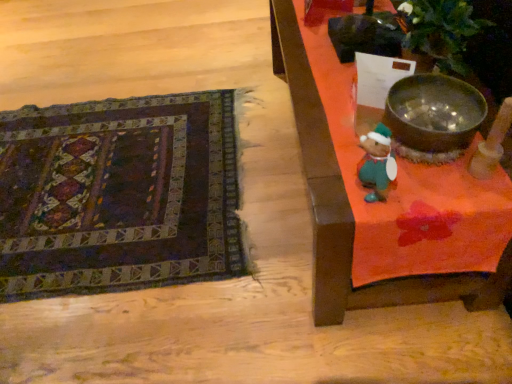
The width and height of the screenshot is (512, 384). I want to click on free spot to the left of shiny metallic bowl at upper right, so click(x=328, y=149).